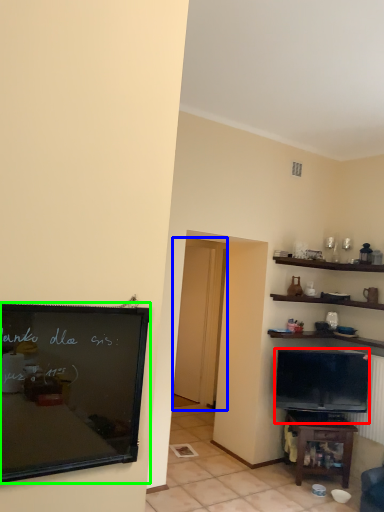
Question: Which is farther away from television (highlighted by a red box)? glass door (highlighted by a blue box) or bulletin board (highlighted by a green box)?

Choices:
 (A) glass door
 (B) bulletin board

Answer: (B)